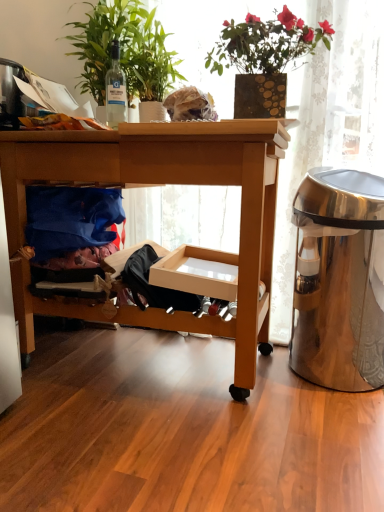
At what (x,y) coordinates should I click in order to perform the action: click on free space in front of satin silver trash can at right. Please return your answer as a coordinate pair (x, y). This screenshot has width=384, height=512. Looking at the image, I should click on (326, 426).